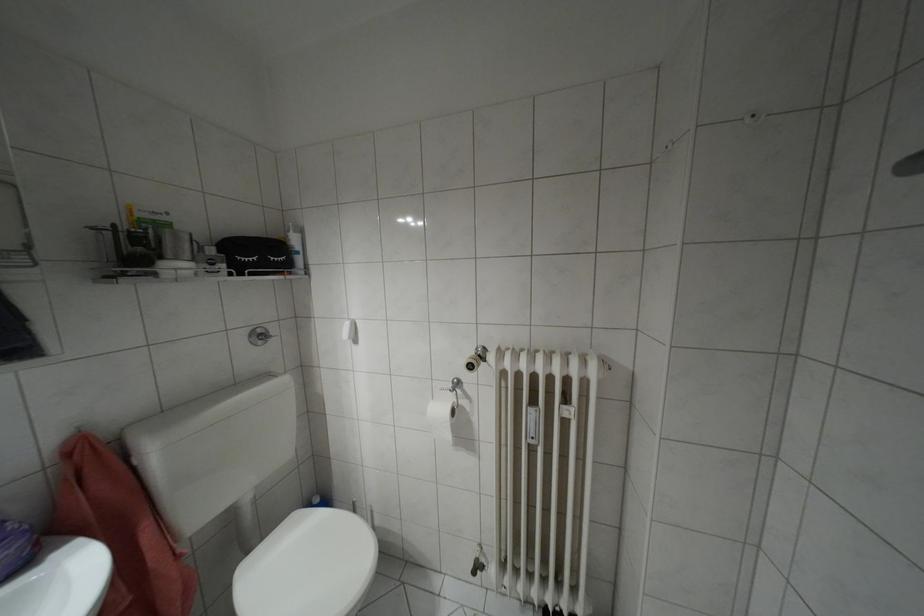
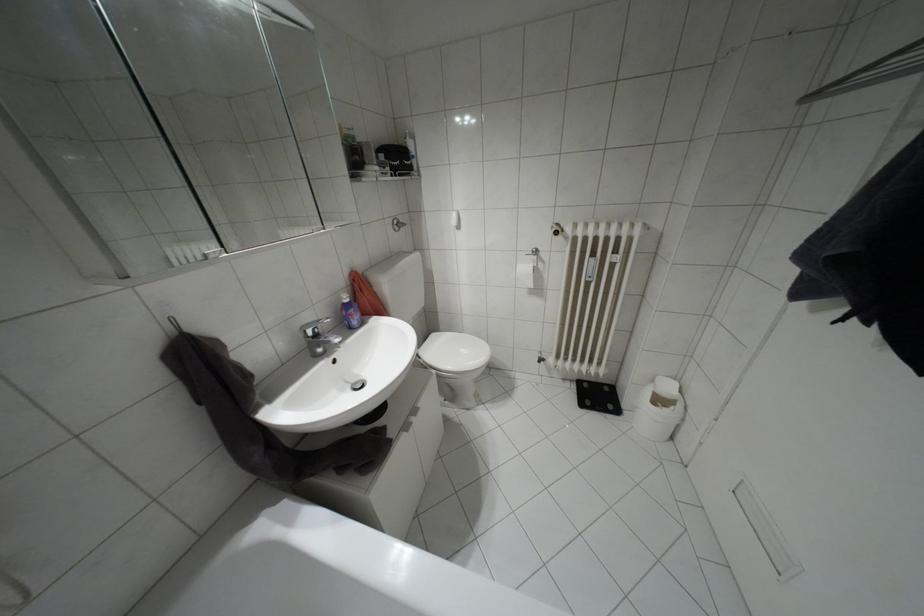
Question: Based on the continuous images, in which direction is the camera rotating? Reply with the corresponding letter.

Choices:
 (A) Left
 (B) Right
 (C) Up
 (D) Down

Answer: (D)